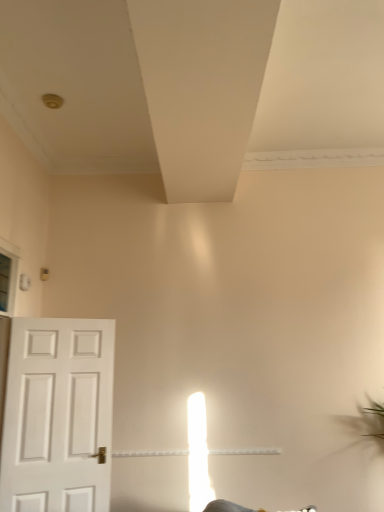
The width and height of the screenshot is (384, 512). What do you see at coordinates (202, 87) in the screenshot?
I see `white matte exhaust hood at upper center` at bounding box center [202, 87].

Where is `white matte exhaust hood at upper center`? white matte exhaust hood at upper center is located at coordinates (202, 87).

Locate an element on the screen. white matte door at left is located at coordinates (58, 416).

Describe the element at coordinates (58, 416) in the screenshot. This screenshot has width=384, height=512. I see `white matte door at left` at that location.

Based on the photo, measure the distance between white matte door at left and camera.

A distance of 2.83 meters exists between white matte door at left and camera.

This screenshot has height=512, width=384. I want to click on white matte exhaust hood at upper center, so (x=202, y=87).

Which is more to the right, white matte door at left or white matte exhaust hood at upper center?

From the viewer's perspective, white matte exhaust hood at upper center appears more on the right side.

Is white matte door at left behind white matte exhaust hood at upper center?

Yes, it is.

Is point (89, 382) closer or farther from the camera than point (178, 140)?

Point (89, 382).

From the image's perspective, is white matte door at left located beneath white matte exhaust hood at upper center?

Correct, white matte door at left appears lower than white matte exhaust hood at upper center in the image.

From a real-world perspective, is white matte door at left below white matte exhaust hood at upper center?

Yes.

Considering the relative sizes of white matte door at left and white matte exhaust hood at upper center in the image provided, is white matte door at left wider than white matte exhaust hood at upper center?

Incorrect, the width of white matte door at left does not surpass that of white matte exhaust hood at upper center.

Which of these two, white matte door at left or white matte exhaust hood at upper center, stands taller?

white matte door at left is taller.

Based on their sizes in the image, would you say white matte door at left is bigger or smaller than white matte exhaust hood at upper center?

In the image, white matte door at left appears to be larger than white matte exhaust hood at upper center.

Do you think white matte door at left is within white matte exhaust hood at upper center, or outside of it?

white matte door at left is located beyond the bounds of white matte exhaust hood at upper center.

Are white matte door at left and white matte exhaust hood at upper center beside each other?

No, white matte door at left is not touching white matte exhaust hood at upper center.

Is white matte door at left turned away from white matte exhaust hood at upper center?

No, white matte door at left's orientation is not away from white matte exhaust hood at upper center.

Locate an element on the screen. door located behind the white matte exhaust hood at upper center is located at coordinates (58, 416).

Considering the relative positions of white matte exhaust hood at upper center and white matte door at left in the image provided, is white matte exhaust hood at upper center to the left of white matte door at left from the viewer's perspective?

No.

Considering their positions, is white matte exhaust hood at upper center located in front of or behind white matte door at left?

white matte exhaust hood at upper center is positioned closer to the viewer than white matte door at left.

Which is in front, point (251, 102) or point (19, 352)?

Point (251, 102)

From the image's perspective, between white matte exhaust hood at upper center and white matte door at left, which one is located above?

white matte exhaust hood at upper center.

From a real-world perspective, which object stands above the other?

white matte exhaust hood at upper center is physically above.

Does white matte exhaust hood at upper center have a greater width compared to white matte door at left?

Yes, white matte exhaust hood at upper center is wider than white matte door at left.

Which of these two, white matte exhaust hood at upper center or white matte door at left, stands taller?

white matte door at left.

Is white matte exhaust hood at upper center bigger or smaller than white matte door at left?

white matte exhaust hood at upper center is smaller than white matte door at left.

Would you say white matte door at left is part of white matte exhaust hood at upper center's contents?

No, white matte door at left is not inside white matte exhaust hood at upper center.

From the picture: Is white matte exhaust hood at upper center placed right next to white matte door at left?

No, white matte exhaust hood at upper center is not in contact with white matte door at left.

Consider the image. Is white matte exhaust hood at upper center facing towards white matte door at left?

No, white matte exhaust hood at upper center is not aimed at white matte door at left.

Can you tell me how much white matte exhaust hood at upper center and white matte door at left differ in facing direction?

The angular difference between white matte exhaust hood at upper center and white matte door at left is 115 degrees.

How far apart are white matte exhaust hood at upper center and white matte door at left?

white matte exhaust hood at upper center and white matte door at left are 6.18 feet apart.

The height and width of the screenshot is (512, 384). Find the location of `door lying behind the white matte exhaust hood at upper center`. door lying behind the white matte exhaust hood at upper center is located at coordinates (58, 416).

Identify the location of exhaust hood that is above the white matte door at left (from the image's perspective). Image resolution: width=384 pixels, height=512 pixels. (202, 87).

In the image, there is a white matte exhaust hood at upper center. Identify the location of door below it (from the image's perspective). The height and width of the screenshot is (512, 384). (58, 416).